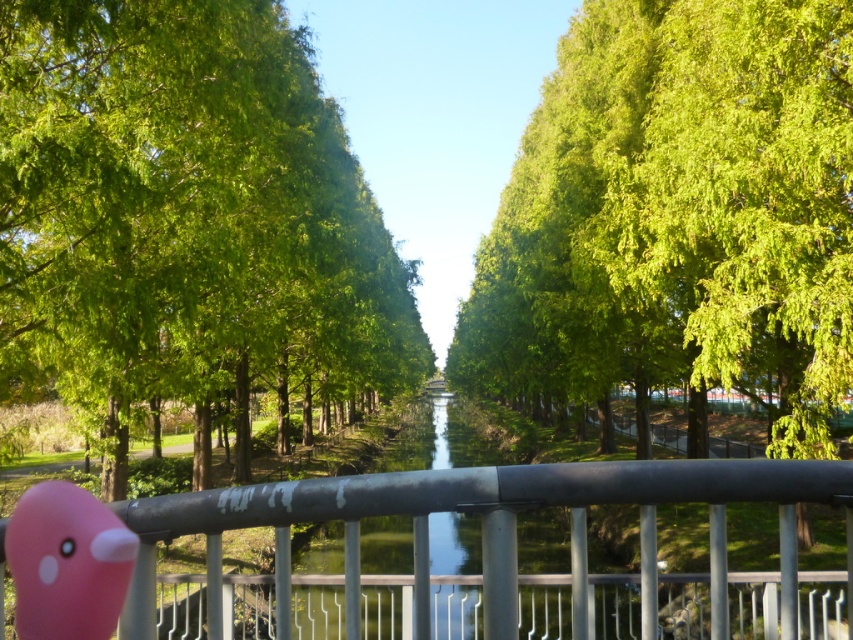
Question: Which point appears farthest from the camera in this image?

Choices:
 (A) (310, 483)
 (B) (71, 276)

Answer: (B)

Question: Among these points, which one is nearest to the camera?

Choices:
 (A) (851, 500)
 (B) (785, 230)
 (C) (339, 310)
 (D) (90, 516)

Answer: (D)

Question: Can you confirm if green leafy trees at center is thinner than metallic gray railing at center?

Choices:
 (A) yes
 (B) no

Answer: (A)

Question: Is green leafy tree at center below pink matte bird at lower left?

Choices:
 (A) yes
 (B) no

Answer: (B)

Question: Among these objects, which one is nearest to the camera?

Choices:
 (A) green leafy tree at center
 (B) metallic gray railing at center

Answer: (B)

Question: Is green leafy trees at center positioned at the back of metallic gray railing at center?

Choices:
 (A) yes
 (B) no

Answer: (A)